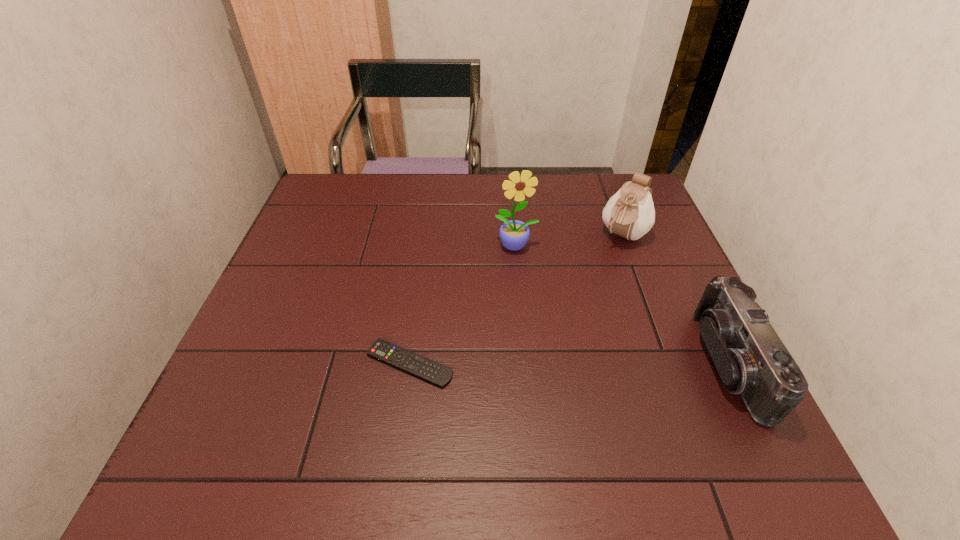
At what (x,y) coordinates should I click in order to perform the action: click on camcorder at the right edge. Please return your answer as a coordinate pair (x, y). Looking at the image, I should click on pyautogui.click(x=751, y=359).

Where is `pouch at the right edge`? pouch at the right edge is located at coordinates (630, 213).

At what (x,y) coordinates should I click in order to perform the action: click on object that is positioned at the near right corner. Please return your answer as a coordinate pair (x, y). The height and width of the screenshot is (540, 960). Looking at the image, I should click on (751, 359).

In the image, there is a desktop. At what (x,y) coordinates should I click in order to perform the action: click on vacant space at the far edge. Please return your answer as a coordinate pair (x, y). This screenshot has height=540, width=960. Looking at the image, I should click on (389, 199).

Identify the location of vacant space at the near edge of the desktop. (583, 397).

The height and width of the screenshot is (540, 960). Find the location of `vacant space at the left edge`. vacant space at the left edge is located at coordinates (346, 227).

Where is `vacant space at the right edge`? vacant space at the right edge is located at coordinates (687, 352).

Where is `vacant area at the far left corner of the desktop`? The image size is (960, 540). vacant area at the far left corner of the desktop is located at coordinates tap(355, 174).

Find the location of a particular element. free space at the far right corner is located at coordinates (598, 181).

I want to click on vacant space at the near right corner of the desktop, so click(660, 387).